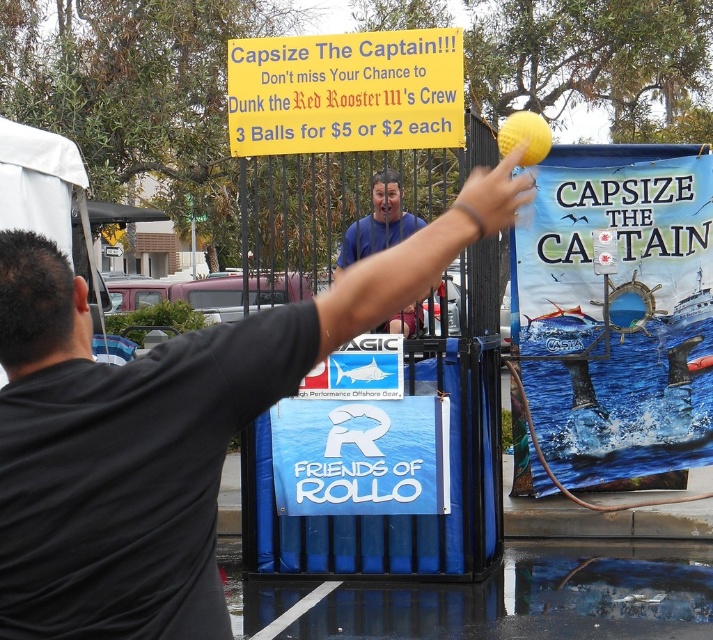
You are a participant in the Capsize The Captain game standing at the throwing line. You notice a black matte shirt at upper center and a yellow paper sign at upper center. How far apart are these two items from each other?

The distance between the black matte shirt at upper center and the yellow paper sign at upper center is 4.72 meters.

You are a participant in the Capsize The Captain game and want to aim your throw at the target. Which participant, the black matte shirt at upper center or the blue shirt at center, is closer to the target?

The black matte shirt at upper center is located below the blue shirt at center, meaning it is closer to the target than the blue shirt at center.

Based on the scene description, where is the yellow paper sign at upper center located in terms of its 2D coordinates?

The yellow paper sign at upper center is located at the 2D coordinates of point (x=344, y=92).